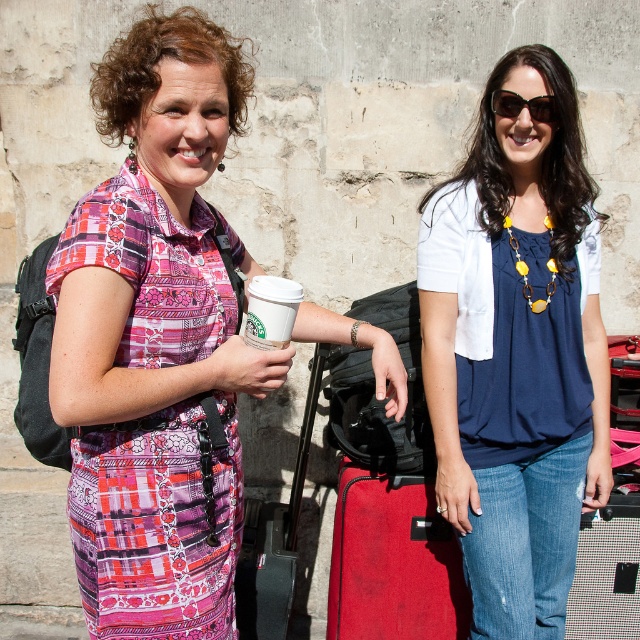
You are standing 3 meters away from a point marked at coordinates point [524,614]. Can you reach that point by taking one step forward?

The distance of point [524,614] from viewer is 2.78 meters. Since you are currently 3 meters away, taking one step forward would bring you closer, but it is unlikely to cover the exact remaining 0.22 meters in a single step. However, you can adjust your step size to reach the point.

You are a delivery person who needs to place a small package in the image. The package is exactly the width of the white paper cup at center. There is a space between the sunglasses at upper center and the stone wall. Can the package fit in that space?

The white paper cup at center is narrower than the sunglasses at upper center, so the package, which is the same width as the white paper cup at center, can fit in the space between the sunglasses at upper center and the stone wall.